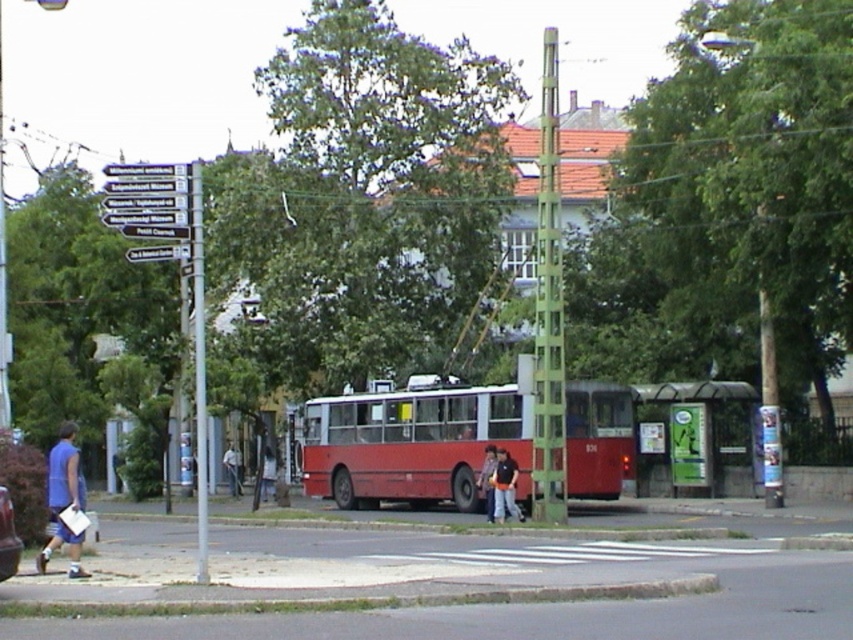
Question: Estimate the real-world distances between objects in this image. Which object is closer to the denim pants at center?

Choices:
 (A) orange fabric shirt at center
 (B) green leafy tree at center

Answer: (A)

Question: From the image, what is the correct spatial relationship of red matte bus at center in relation to metallic silver car at lower left?

Choices:
 (A) left
 (B) right

Answer: (B)

Question: Does metallic silver car at lower left lie behind orange fabric shirt at center?

Choices:
 (A) no
 (B) yes

Answer: (A)

Question: Which of the following is the closest to the observer?

Choices:
 (A) silver metallic pole at left
 (B) gray concrete curb at lower center
 (C) metallic silver car at lower left

Answer: (B)

Question: Which point is closer to the camera?

Choices:
 (A) (558, 449)
 (B) (715, 381)
 (C) (271, 497)
 (D) (67, 480)

Answer: (D)

Question: Is silver metallic pole at left below denim pants at center?

Choices:
 (A) yes
 (B) no

Answer: (B)